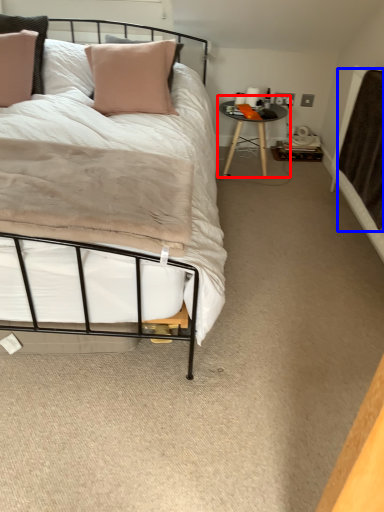
Question: Which object is closer to the camera taking this photo, table (highlighted by a red box) or blanket (highlighted by a blue box)?

Choices:
 (A) table
 (B) blanket

Answer: (B)